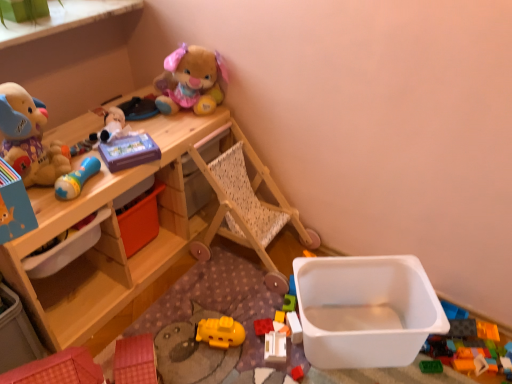
Where is `free space between yellow plastic submarine at center, the sixth toy when ordered from top to bottom, and white plastic toy at center, the 1th toy from the bottom`? free space between yellow plastic submarine at center, the sixth toy when ordered from top to bottom, and white plastic toy at center, the 1th toy from the bottom is located at coordinates (251, 348).